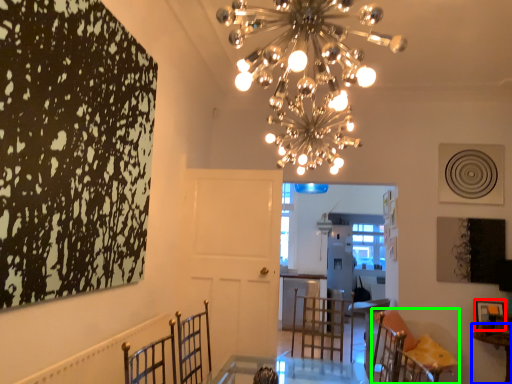
Question: Based on their relative distances, which object is nearer to picture frame (highlighted by a red box)? Choose from table (highlighted by a blue box) and furniture (highlighted by a green box).

Choices:
 (A) table
 (B) furniture

Answer: (A)